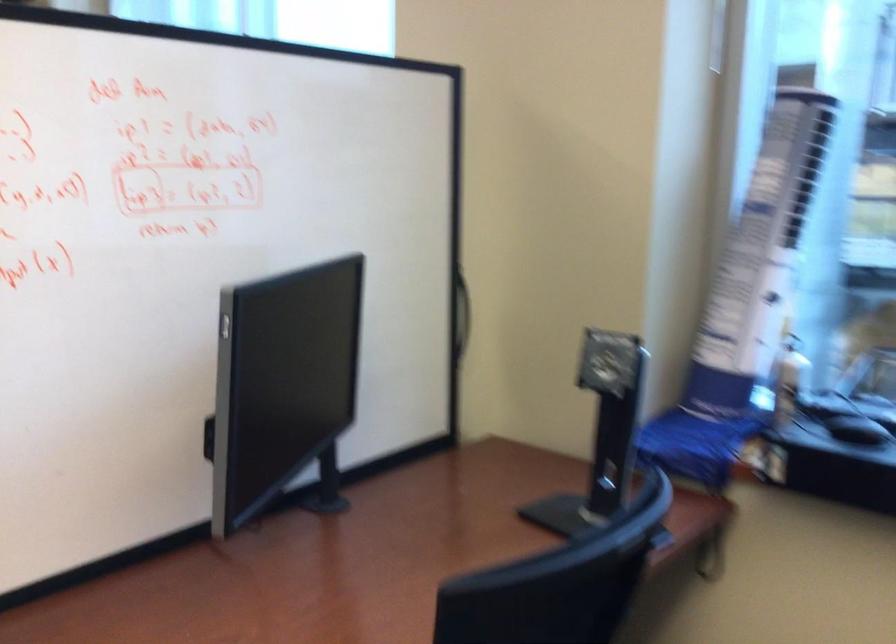
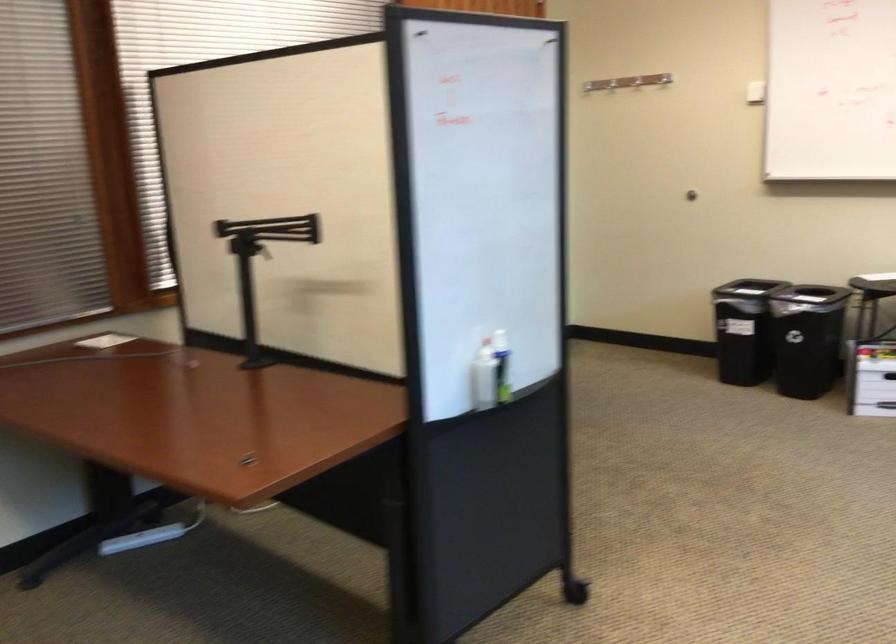
Question: The first image is from the beginning of the video and the second image is from the end. How did the camera likely rotate when shooting the video?

Choices:
 (A) Left
 (B) Right
 (C) Up
 (D) Down

Answer: (A)